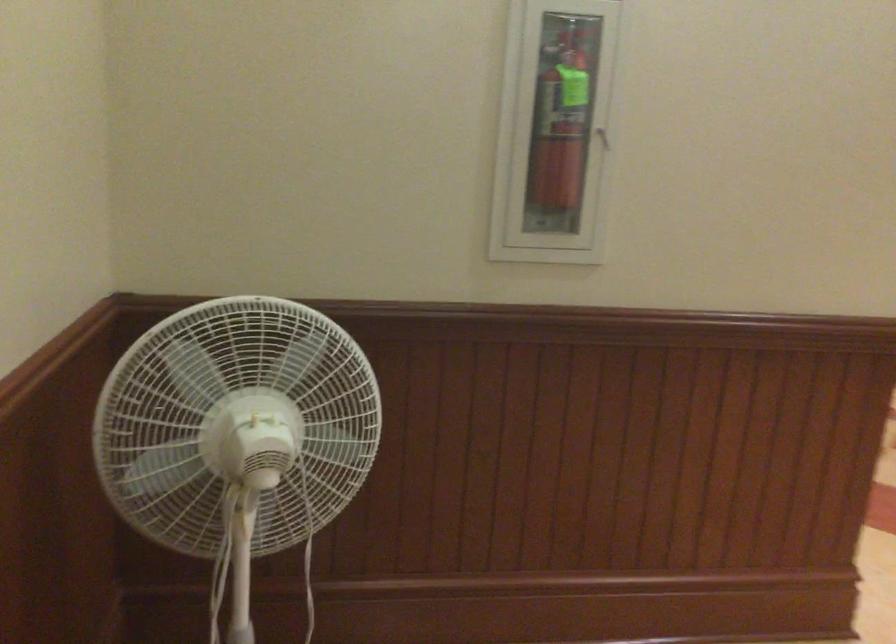
Find where to pull the extinguisher case handle. Please return your answer as a coordinate pair (x, y).

(606, 137)